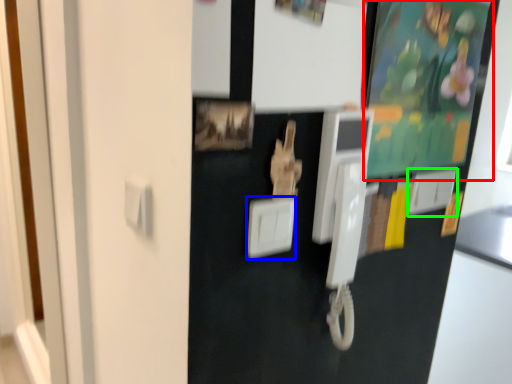
Question: Which object is the farthest from bulletin board (highlighted by a red box)? Choose among these: light switch (highlighted by a blue box) or light switch (highlighted by a green box).

Choices:
 (A) light switch
 (B) light switch

Answer: (A)